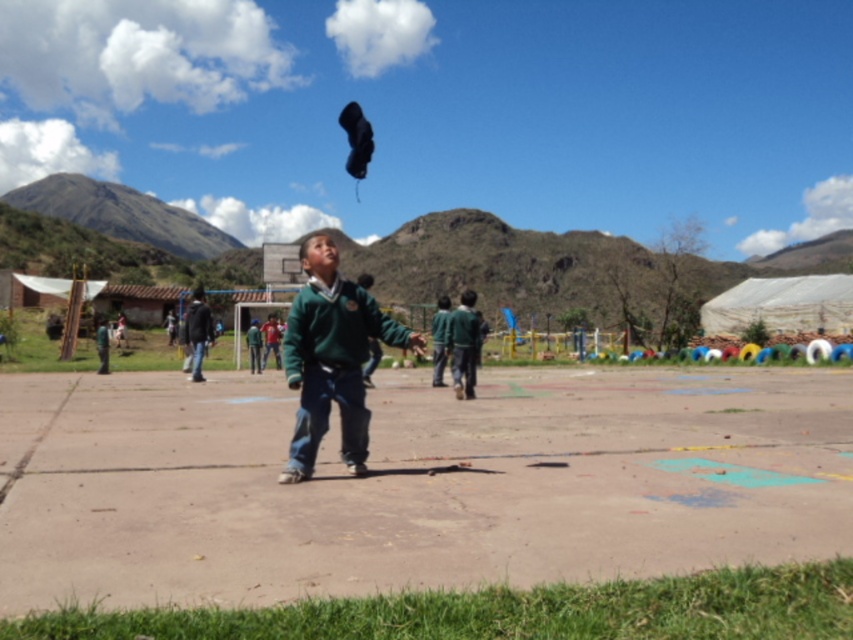
You are a photographer standing at the edge of the schoolyard. You want to take a photo of the green matte sweater at center and the dark gray hoodie at left. The camera you are using has a maximum focus range of 10 meters. Can you capture both subjects in focus without moving?

The green matte sweater at center is 11.24 meters away from the dark gray hoodie at left. Since the camera can only focus up to 10 meters, the distance between them exceeds the focus range. Therefore, you cannot capture both in focus without moving.

You are a photographer trying to capture a clear shot of both the green matte sweater at center and the green matte uniform at center. Which one would appear larger in your photo?

The green matte sweater at center would appear larger in the photo because it is closer to the viewer than the green matte uniform at center.